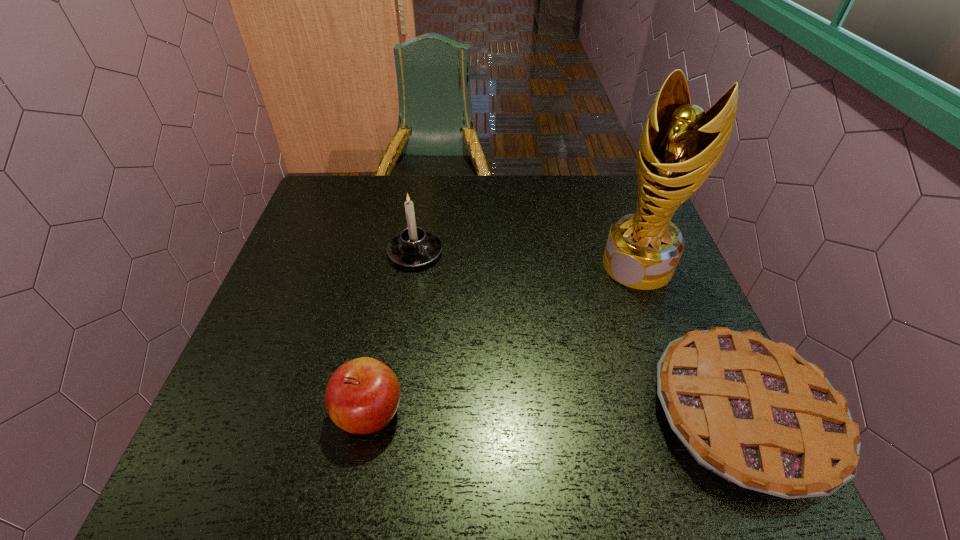
Identify the location of blank space at the right edge. The height and width of the screenshot is (540, 960). (657, 299).

Locate an element on the screen. vacant area at the far left corner is located at coordinates (327, 191).

This screenshot has width=960, height=540. In order to click on empty location between the pie and the second shortest object in this screenshot , I will do `click(555, 414)`.

Find the location of a particular element. This screenshot has height=540, width=960. free space between the candle holder and the apple is located at coordinates (393, 333).

Identify the location of free space between the award and the candle holder. This screenshot has width=960, height=540. (527, 259).

The image size is (960, 540). What are the coordinates of `vacant space that's between the tallest object and the second tallest object` in the screenshot? It's located at (527, 259).

What are the coordinates of `vacant space in between the shortest object and the candle holder` in the screenshot? It's located at 578,334.

This screenshot has width=960, height=540. I want to click on vacant point located between the tallest object and the third shortest object, so click(527, 259).

At what (x,y) coordinates should I click in order to perform the action: click on vacant area between the award and the candle holder. Please return your answer as a coordinate pair (x, y). Looking at the image, I should click on (527, 259).

At what (x,y) coordinates should I click in order to perform the action: click on free point between the candle holder and the shortest object. Please return your answer as a coordinate pair (x, y). The height and width of the screenshot is (540, 960). Looking at the image, I should click on (578, 334).